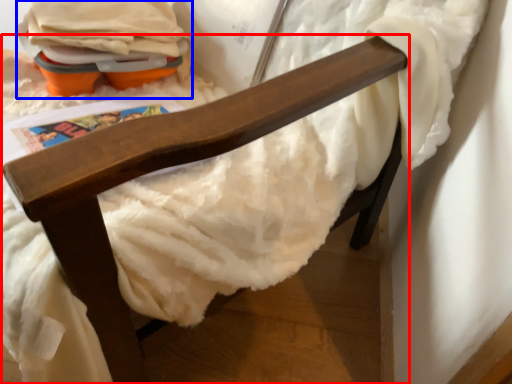
Question: Among these objects, which one is nearest to the camera, furniture (highlighted by a red box) or toy (highlighted by a blue box)?

Choices:
 (A) furniture
 (B) toy

Answer: (A)